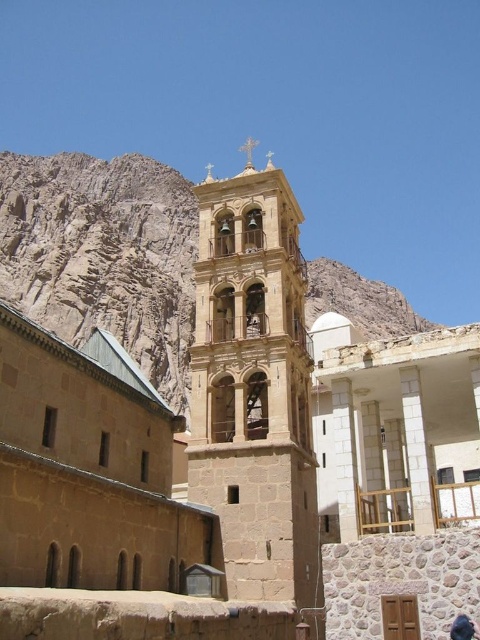
You are standing in front of the historic complex and want to take a photo that includes both the stone bell tower at center and the brown rocky mountain at upper left. Which object should you frame first to ensure both are visible in the photo?

The stone bell tower at center is smaller than the brown rocky mountain at upper left, so you should frame the brown rocky mountain at upper left first to ensure both are visible in the photo.

You are standing at the point marked by the coordinate point at (253, 385) in the image. Which object are you directly facing?

The point at (253, 385) marks the stone bell tower at center, so you are directly facing the stone bell tower at center.

You are standing at the base of the bell tower in the historic complex and see a point marked at coordinates (104, 253). Based on the scene description, where is this point located?

The point at (104, 253) is located on the brown rocky mountain at upper left.